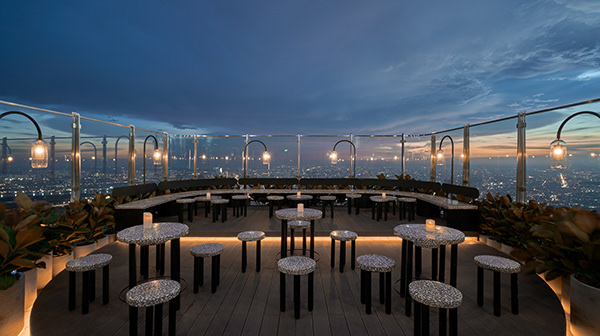
This screenshot has width=600, height=336. Identify the location of breakfast bar. (302, 187).